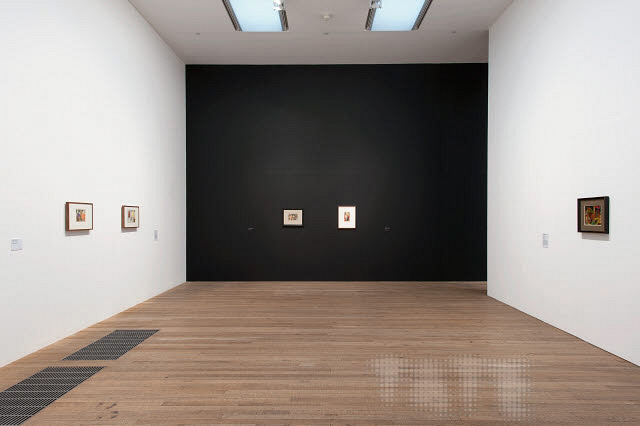
This screenshot has width=640, height=426. I want to click on 1 vent on the right, so click(x=112, y=348).